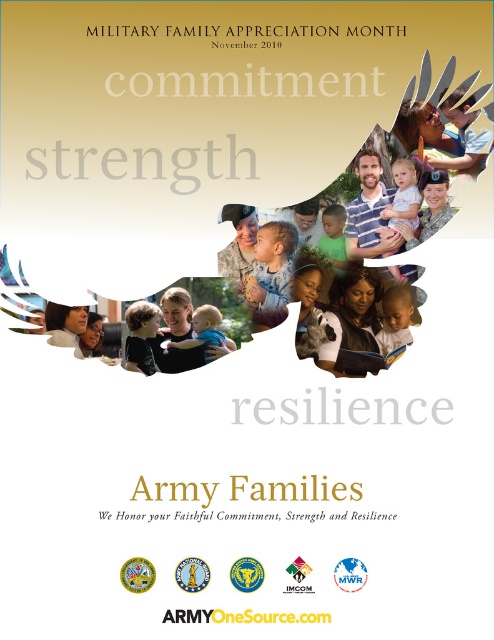
Question: Which object appears closest to the camera in this image?

Choices:
 (A) smooth skin child at center
 (B) soft beige baby at center
 (C) pink fabric dress at center
 (D) light brown skin at center

Answer: (C)

Question: Does soft beige baby at center have a larger size compared to pink fabric dress at center?

Choices:
 (A) yes
 (B) no

Answer: (B)

Question: Does smooth skin child at center have a smaller size compared to soft beige baby at center?

Choices:
 (A) yes
 (B) no

Answer: (B)

Question: Among these objects, which one is nearest to the camera?

Choices:
 (A) pink fabric dress at center
 (B) smooth skin child at center
 (C) light brown skin at center

Answer: (A)

Question: Which of the following is the closest to the observer?

Choices:
 (A) (403, 216)
 (B) (397, 294)
 (C) (199, 330)

Answer: (A)

Question: Considering the relative positions of light brown skin at center and soft beige baby at center in the image provided, where is light brown skin at center located with respect to soft beige baby at center?

Choices:
 (A) left
 (B) right

Answer: (B)